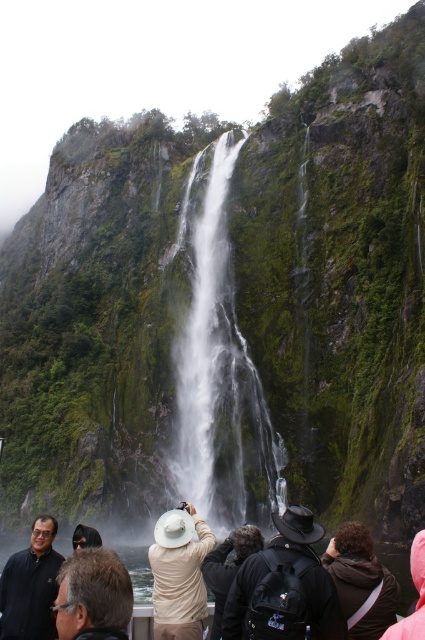
Is point (98, 584) less distant than point (380, 634)?

Yes, point (98, 584) is closer to viewer.

How distant is brown hair at lower left from dark brown leather jacket at lower center?

brown hair at lower left and dark brown leather jacket at lower center are 14.38 meters apart.

Is point (107, 580) farther from camera compared to point (337, 544)?

That is False.

The width and height of the screenshot is (425, 640). Find the location of `brown hair at lower left`. brown hair at lower left is located at coordinates (93, 596).

Is point (271, 477) in front of point (419, 554)?

No, it is behind (419, 554).

Between white smooth waterfall at center and pink fabric at lower right, which one appears on the right side from the viewer's perspective?

pink fabric at lower right

Describe the element at coordinates (220, 372) in the screenshot. I see `white smooth waterfall at center` at that location.

Image resolution: width=425 pixels, height=640 pixels. Find the location of `white smooth waterfall at center`. white smooth waterfall at center is located at coordinates (220, 372).

Where is `beige fabric hat at center`? This screenshot has width=425, height=640. beige fabric hat at center is located at coordinates (178, 573).

Which is more to the left, beige fabric hat at center or pink fabric at lower right?

Positioned to the left is beige fabric hat at center.

Is point (155, 634) closer to viewer compared to point (421, 531)?

That is True.

Locate an element on the screen. This screenshot has height=640, width=425. beige fabric hat at center is located at coordinates tap(178, 573).